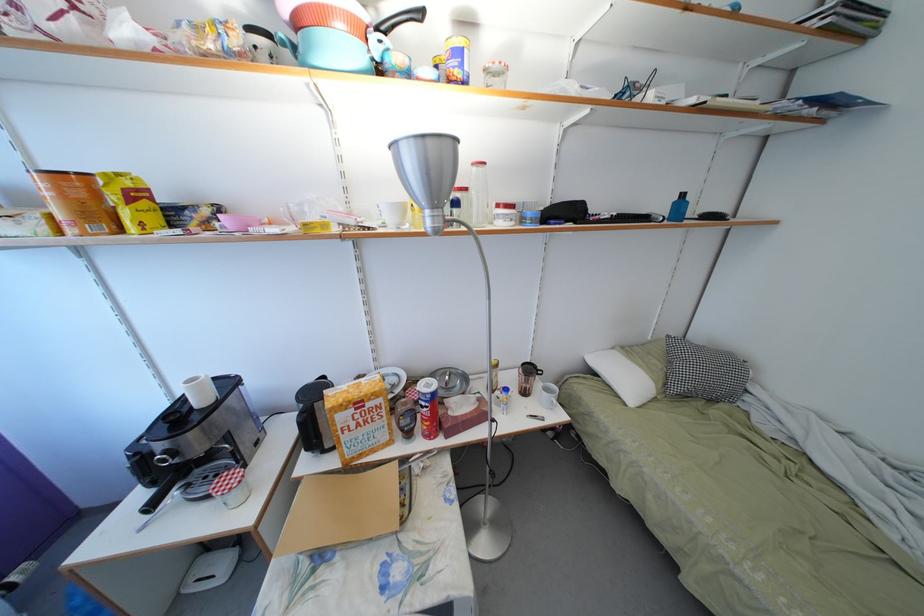
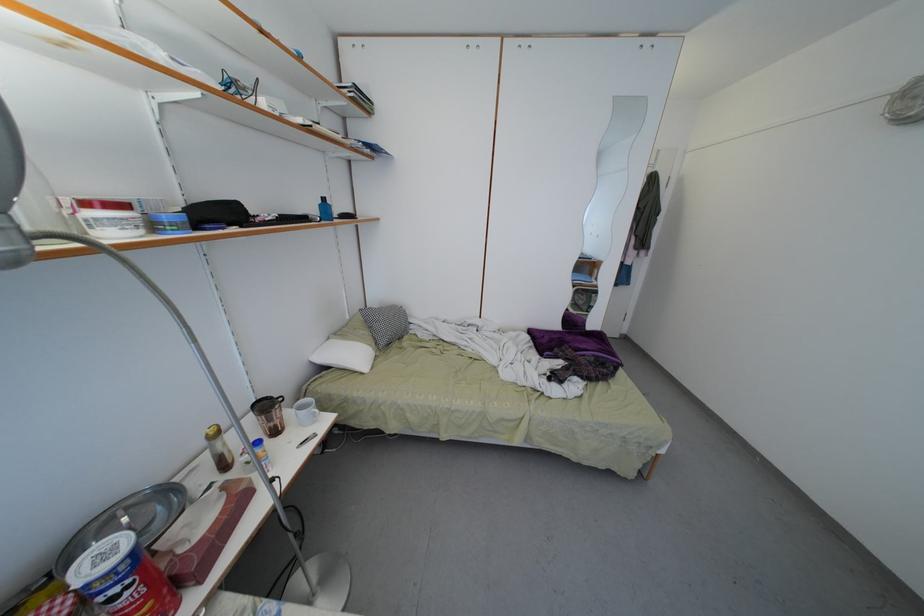
In the second image, find the point that corresponds to the point at 429,408 in the first image.

(120, 596)